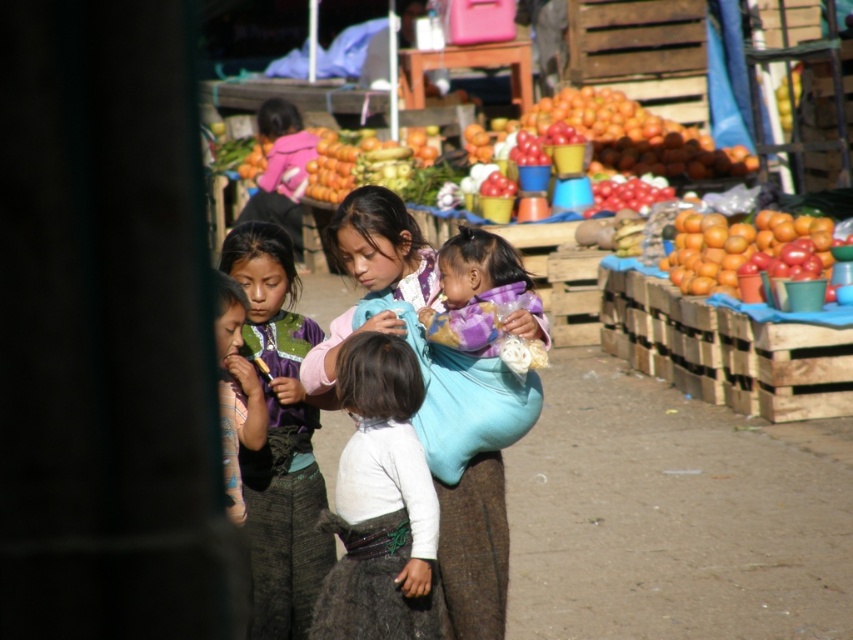
You are a photographer trying to capture a candid shot of the children in the market scene. You notice the white soft shirt at center and the purple fabric at center. Which clothing item would you focus on to ensure it fits entirely within your camera frame if your frame can only accommodate the smaller of the two?

Result: The white soft shirt at center occupies less space than purple fabric at center, so focusing on the white soft shirt at center would ensure it fits entirely within the camera frame.

You are standing at the entrance of the market and see the point marked at coordinates (380,502). What object is located at that point?

The point at coordinates (380,502) indicates the white soft shirt at center.